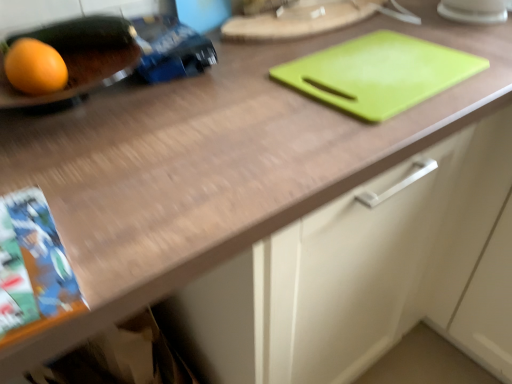
Where is `free spot above green plastic cutting board at upper center, which appears as the 2th tray when viewed from the right (from a real-world perspective)`? Image resolution: width=512 pixels, height=384 pixels. free spot above green plastic cutting board at upper center, which appears as the 2th tray when viewed from the right (from a real-world perspective) is located at coordinates (303, 13).